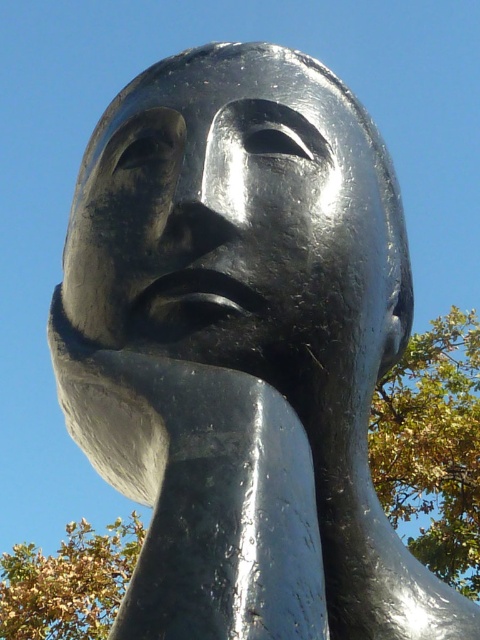
You are an artist planning to photograph the shiny black sculpture at center and the green leafy tree at right. If you want to capture the full width of both subjects in a single frame, which subject should you focus on to ensure both fit?

The shiny black sculpture at center is narrower than the green leafy tree at right, so you should focus on the tree to ensure both fit in the frame.

From the picture: You are an artist setting up an outdoor studio near the sculpture. You want to position your easel so that it doesn not block the view of the sculpture from the main path. The path is directly in front of the sculpture. Which tree should you place your easel closer to, the green leafy tree at right or the green leafy tree at lower left, to ensure the easel stays out of the viewer s line of sight?

The green leafy tree at right is taller than the green leafy tree at lower left. To keep the easel out of the viewer s line of sight, position it closer to the shorter green leafy tree at lower left since its lower height is less likely to block the view of the sculpture from the main path.